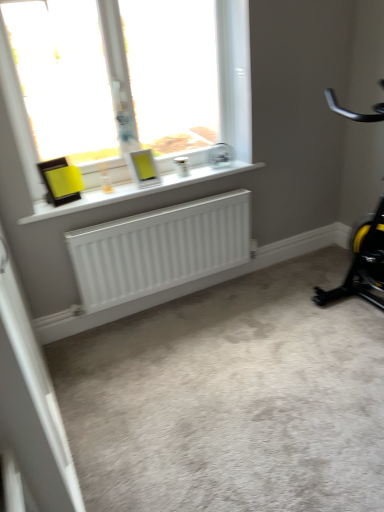
Locate an element on the screen. The width and height of the screenshot is (384, 512). vacant space to the left of black/yellow plastic stationary bicycle at right is located at coordinates (289, 320).